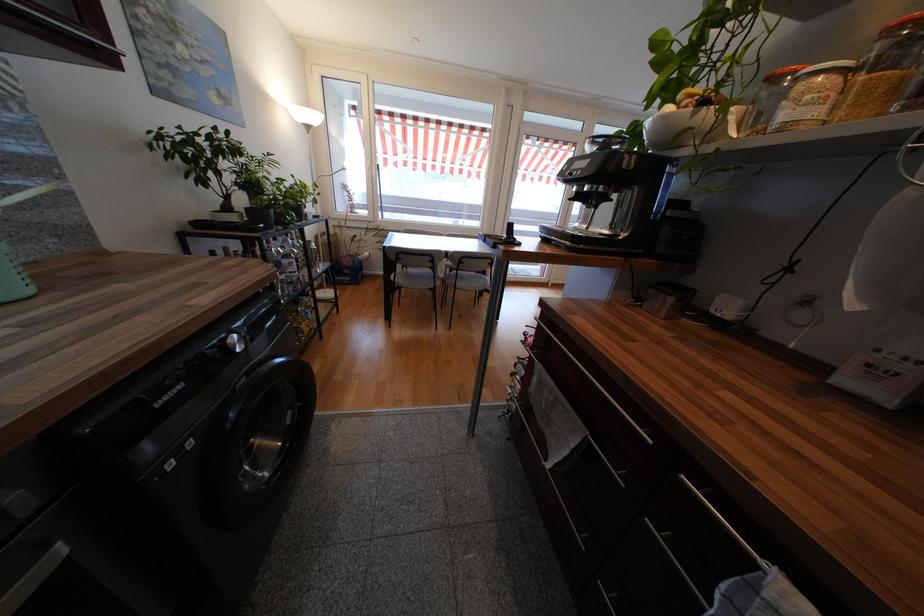
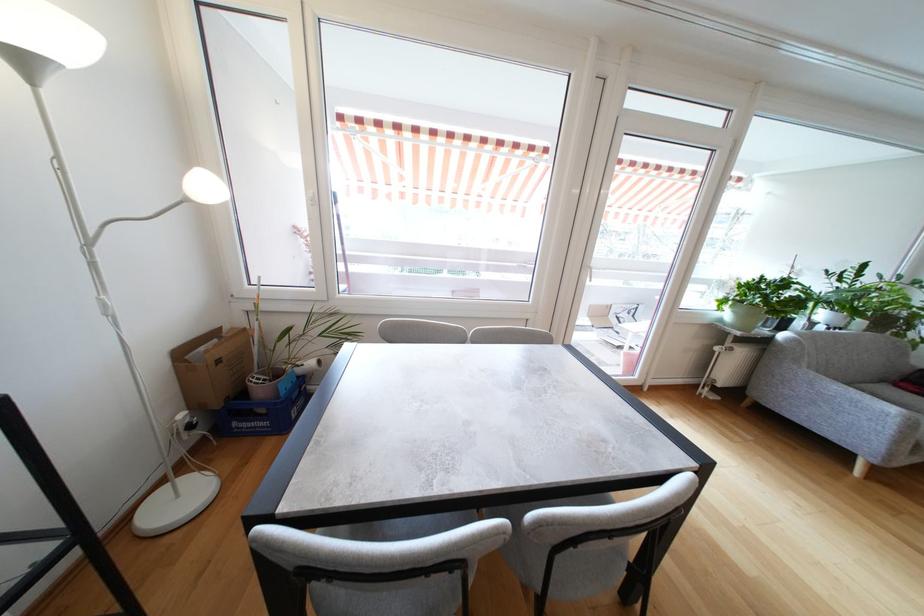
In the second image, find the point that corresponds to (x=372, y=171) in the first image.

(315, 201)